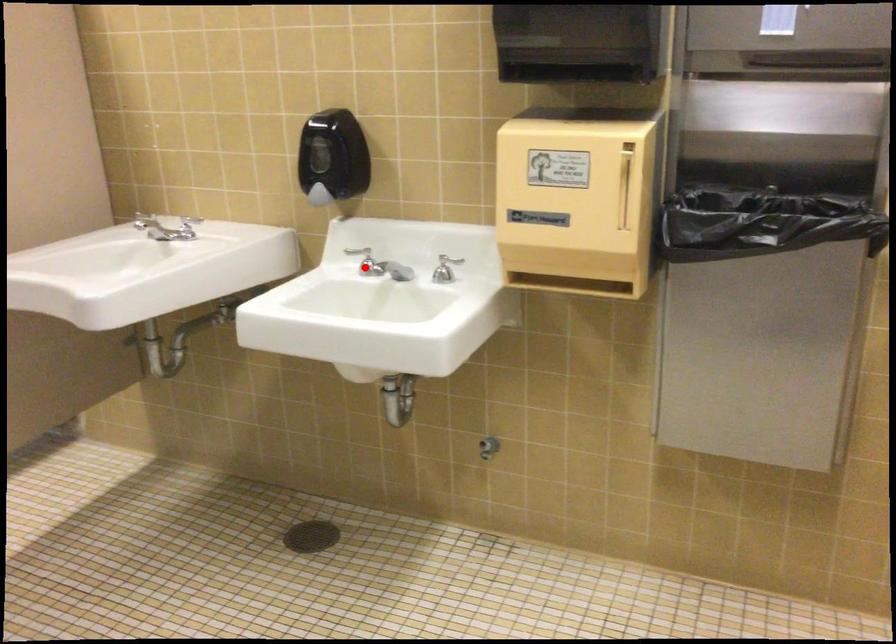
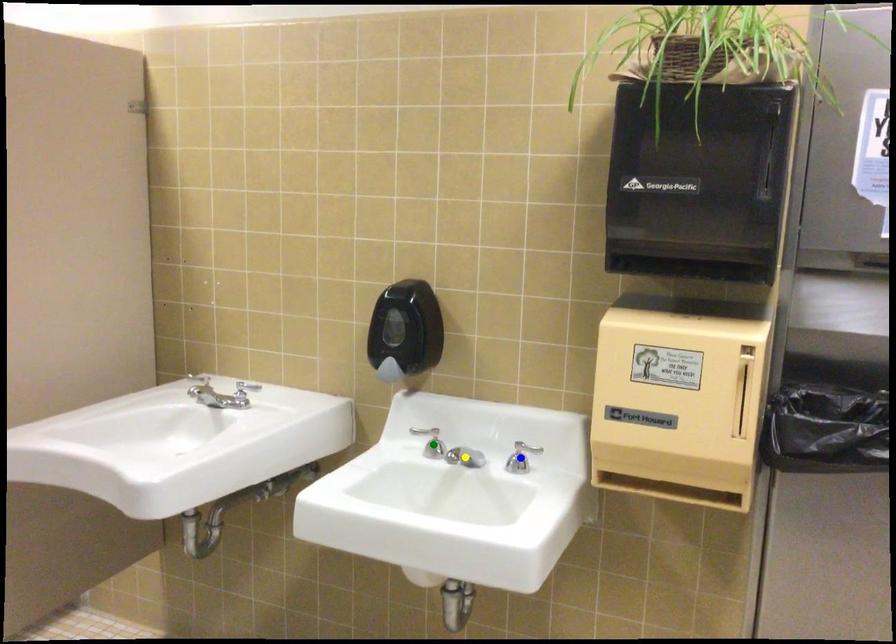
Question: I am providing you with two images of the same scene from different viewpoints. A red point is marked on the first image. You are given multiple points on the second image. Which spot in image 2 lines up with the point in image 1?

Choices:
 (A) blue point
 (B) yellow point
 (C) green point

Answer: (C)